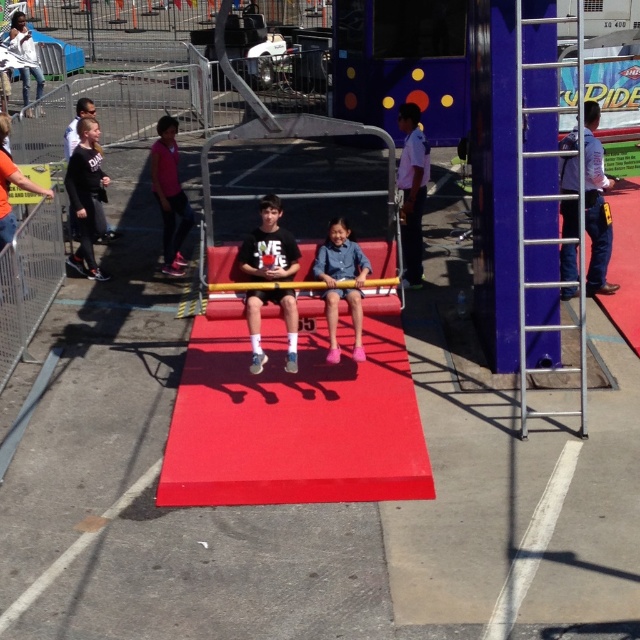
Question: Can you confirm if denim shorts at center is positioned above white shirt at upper left?

Choices:
 (A) yes
 (B) no

Answer: (B)

Question: Which object appears closest to the camera in this image?

Choices:
 (A) matte black t-shirt at center
 (B) denim shorts at center
 (C) white shirt at upper left

Answer: (A)

Question: Which of the following is the farthest from the observer?

Choices:
 (A) (10, 28)
 (B) (588, 145)

Answer: (A)

Question: In this image, where is red rubber mat at center located relative to matte black t-shirt at center?

Choices:
 (A) left
 (B) right

Answer: (B)

Question: Which is farther from the white shirt at upper left?

Choices:
 (A) denim shorts at center
 (B) pink fabric pants at center

Answer: (A)

Question: Does matte black t-shirt at center appear under pink fabric pants at center?

Choices:
 (A) no
 (B) yes

Answer: (B)